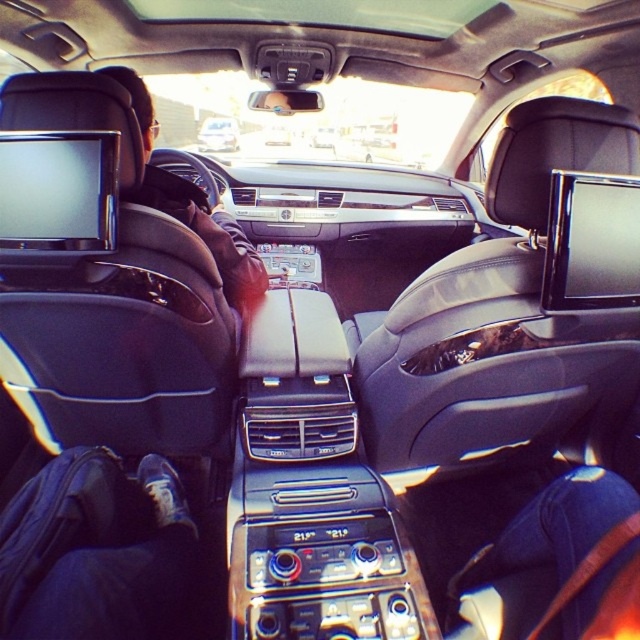
You are a delivery person who needs to place a small package between the leather jacket at left and the metallic silver car at center. The package requires a minimum of 5 meters of space to be placed safely. Can you safely place the package there?

The distance between the leather jacket at left and the metallic silver car at center is 8.43 meters, which is more than the required 5 meters. Therefore, the package can be safely placed there.

You are sitting in the backseat of the car and want to grab your leather jacket at left. Which side of the metallic silver car at center should you reach towards to get it?

The leather jacket at left is to the right of the metallic silver car at center, so you should reach towards the right side of the metallic silver car at center to get it.